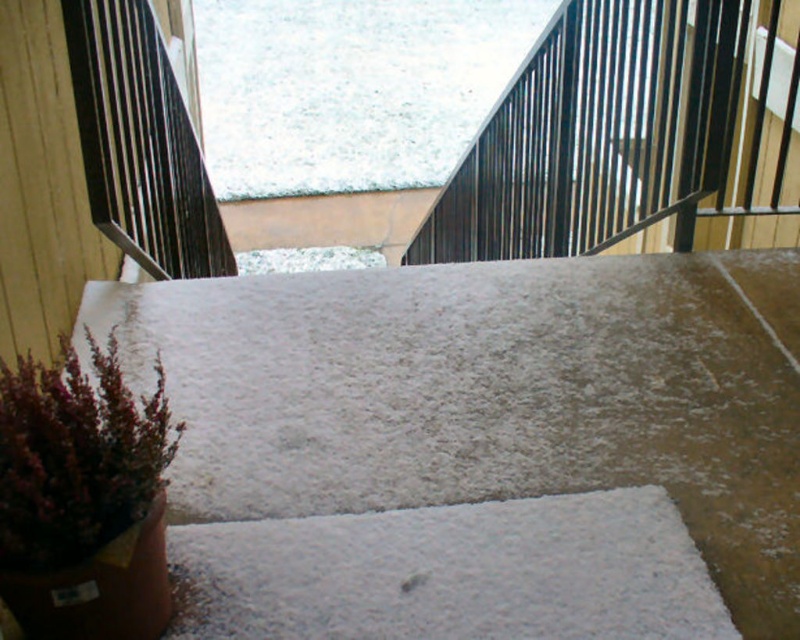
Question: Which object appears closest to the camera in this image?

Choices:
 (A) purple matte plant at lower left
 (B) black metal rail at upper center
 (C) white fluffy snow at upper center
 (D) white textured carpet at center

Answer: (A)

Question: Is white textured ramp at lower left thinner than white textured carpet at center?

Choices:
 (A) yes
 (B) no

Answer: (B)

Question: Is white textured ramp at lower left to the right of purple matte plant at lower left from the viewer's perspective?

Choices:
 (A) no
 (B) yes

Answer: (B)

Question: Which object is positioned farthest from the white textured ramp at lower left?

Choices:
 (A) white fluffy snow at upper center
 (B) white textured carpet at center

Answer: (A)

Question: Which object appears farthest from the camera in this image?

Choices:
 (A) white textured ramp at lower left
 (B) white fluffy snow at upper center

Answer: (B)

Question: Considering the relative positions of black metal rail at upper center and white textured carpet at center in the image provided, where is black metal rail at upper center located with respect to white textured carpet at center?

Choices:
 (A) right
 (B) left

Answer: (A)